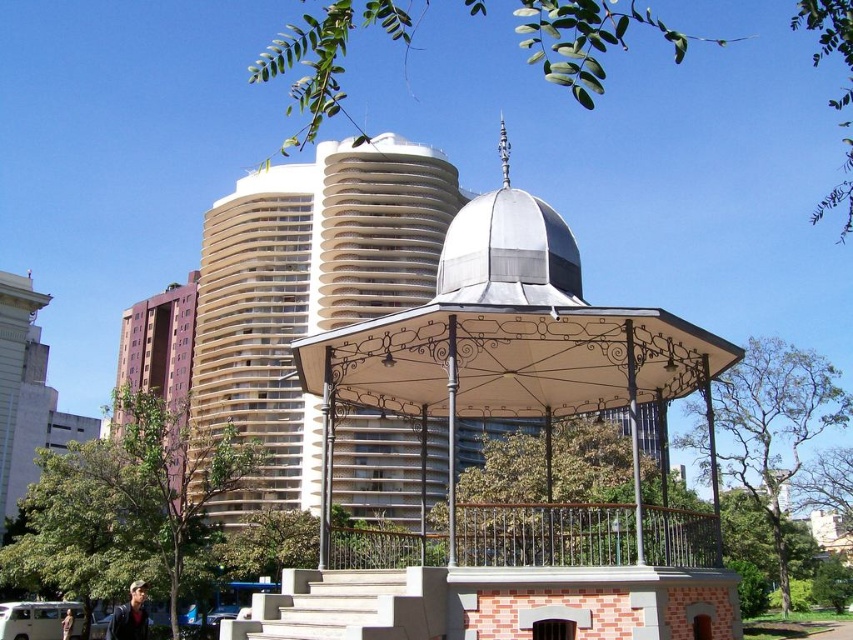
Is white wrought iron gazebo at center further to camera compared to beige concrete tower at center?

That is False.

Which of these two, white wrought iron gazebo at center or beige concrete tower at center, stands taller?

Standing taller between the two is beige concrete tower at center.

Is point (631, 458) behind point (416, 288)?

No.

Find the location of a particular element. The width and height of the screenshot is (853, 640). white wrought iron gazebo at center is located at coordinates (509, 417).

Does white wrought iron gazebo at center appear over purple matte building at left?

No.

The width and height of the screenshot is (853, 640). I want to click on white wrought iron gazebo at center, so click(509, 417).

At what (x,y) coordinates should I click in order to perform the action: click on white wrought iron gazebo at center. Please return your answer as a coordinate pair (x, y). The image size is (853, 640). Looking at the image, I should click on (509, 417).

Can you confirm if beige concrete tower at center is bigger than purple matte building at left?

Yes, beige concrete tower at center is bigger than purple matte building at left.

Can you confirm if beige concrete tower at center is positioned to the left of purple matte building at left?

In fact, beige concrete tower at center is to the right of purple matte building at left.

Locate an element on the screen. The image size is (853, 640). beige concrete tower at center is located at coordinates (306, 291).